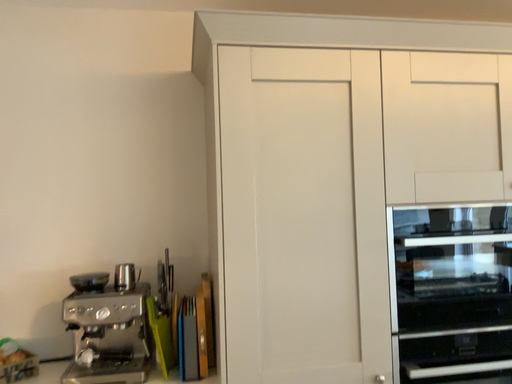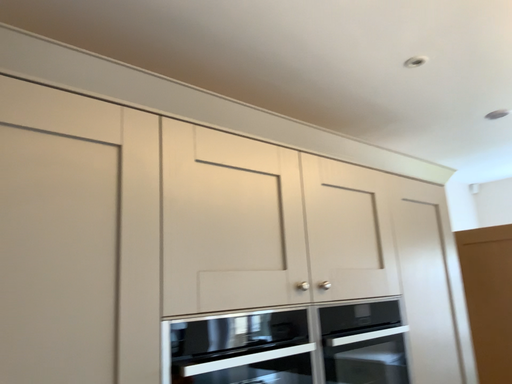
Question: Which way did the camera rotate in the video?

Choices:
 (A) rotated downward
 (B) rotated upward

Answer: (B)